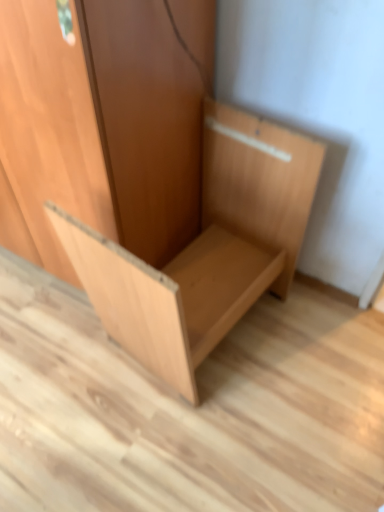
The image size is (384, 512). Identify the location of vacant space to the right of light brown wood chair at center. (321, 353).